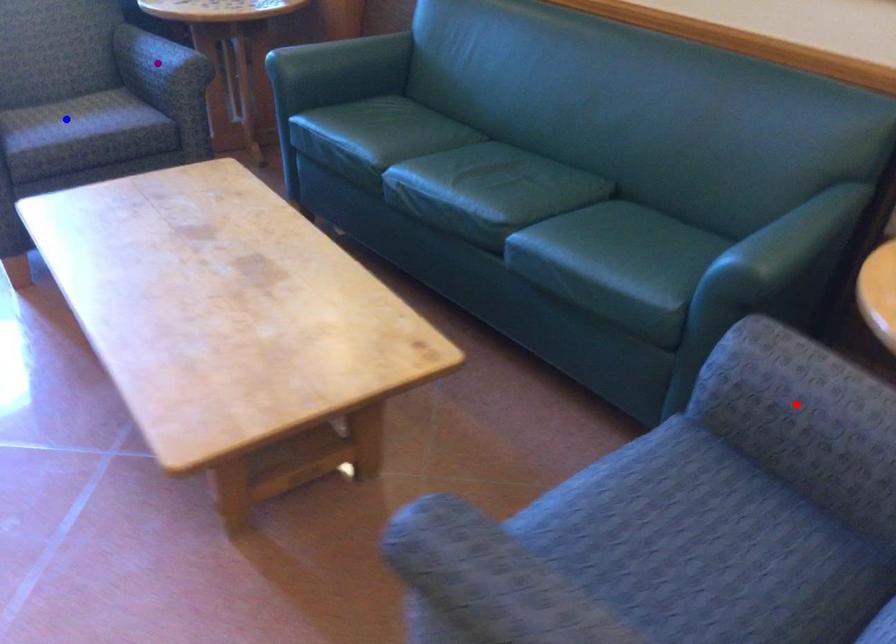
Order these from nearest to farthest:
blue point
red point
purple point

red point, blue point, purple point